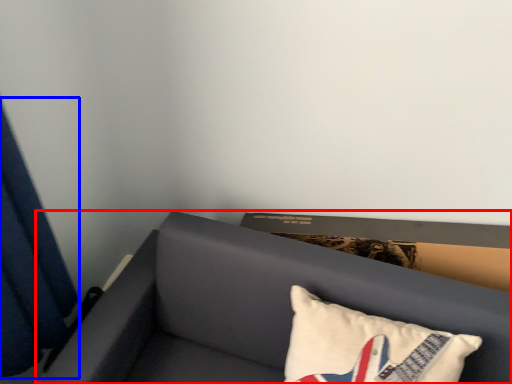
Question: Which object is further to the camera taking this photo, furniture (highlighted by a red box) or curtain (highlighted by a blue box)?

Choices:
 (A) furniture
 (B) curtain

Answer: (A)